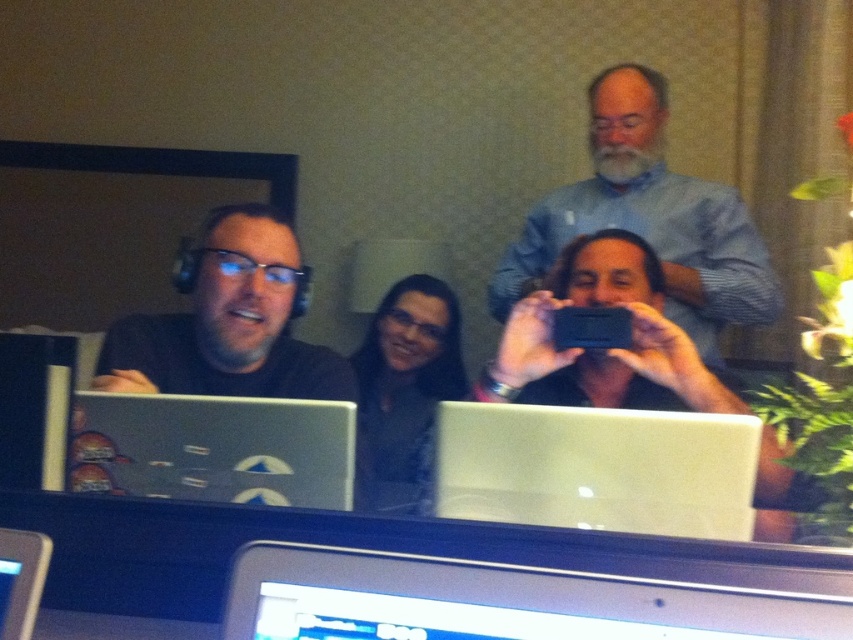
Is silver metallic laptop at lower left bigger than matte black headphones at left?

Incorrect, silver metallic laptop at lower left is not larger than matte black headphones at left.

Can you confirm if silver metallic laptop at lower left is taller than matte black headphones at left?

In fact, silver metallic laptop at lower left may be shorter than matte black headphones at left.

Which is in front, point (286, 452) or point (165, 323)?

Point (286, 452)

This screenshot has height=640, width=853. Identify the location of silver metallic laptop at lower left. (213, 449).

Is point (717, 186) behind point (386, 308)?

No, it is not.

Locate an element on the screen. blue striped shirt at upper center is located at coordinates (648, 220).

The height and width of the screenshot is (640, 853). What are the coordinates of `blue striped shirt at upper center` in the screenshot? It's located at (648, 220).

Is blue striped shirt at upper center to the right of silver metallic laptop at lower left from the viewer's perspective?

Correct, you'll find blue striped shirt at upper center to the right of silver metallic laptop at lower left.

Is point (604, 129) positioned in front of point (297, 490)?

No, (604, 129) is further to viewer.

The image size is (853, 640). Identify the location of blue striped shirt at upper center. (648, 220).